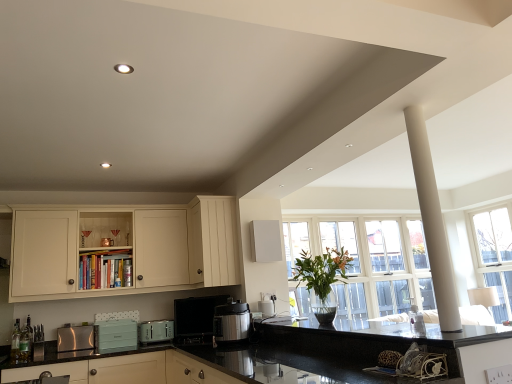
Question: Is black granite countertop at center, acting as the second countertop starting from the right, facing away from white smooth column at upper right?

Choices:
 (A) yes
 (B) no

Answer: (B)

Question: From a real-world perspective, is black granite countertop at center, acting as the second countertop starting from the right, below white smooth column at upper right?

Choices:
 (A) no
 (B) yes

Answer: (B)

Question: Does black granite countertop at center, acting as the second countertop starting from the right, have a smaller size compared to white smooth column at upper right?

Choices:
 (A) yes
 (B) no

Answer: (B)

Question: Considering the relative positions of black granite countertop at center, the 1th countertop when ordered from left to right, and white smooth column at upper right in the image provided, is black granite countertop at center, the 1th countertop when ordered from left to right, to the left of white smooth column at upper right from the viewer's perspective?

Choices:
 (A) no
 (B) yes

Answer: (B)

Question: Is black granite countertop at center, acting as the second countertop starting from the right, with white smooth column at upper right?

Choices:
 (A) no
 (B) yes

Answer: (A)

Question: Is green glass bottle at lower left, positioned as the second bottle in left-to-right order, taller or shorter than translucent glass bottle at lower left, which is the second bottle from top to bottom?

Choices:
 (A) tall
 (B) short

Answer: (A)

Question: Does point (24, 340) appear closer or farther from the camera than point (11, 334)?

Choices:
 (A) closer
 (B) farther

Answer: (B)

Question: Based on their sizes in the image, would you say green glass bottle at lower left, positioned as the second bottle in left-to-right order, is bigger or smaller than translucent glass bottle at lower left, arranged as the third bottle when viewed from the back?

Choices:
 (A) small
 (B) big

Answer: (B)

Question: From a real-world perspective, is green glass bottle at lower left, the second bottle viewed from the front, physically located above or below translucent glass bottle at lower left, which is the second bottle from top to bottom?

Choices:
 (A) below
 (B) above

Answer: (B)

Question: From a real-world perspective, is matte cream cabinets at lower center, the 3th cabinetry when ordered from top to bottom, physically located above or below metallic silver pressure cooker at center?

Choices:
 (A) above
 (B) below

Answer: (B)

Question: Would you say matte cream cabinets at lower center, placed as the 1th cabinetry when sorted from bottom to top, is to the left or to the right of metallic silver pressure cooker at center in the picture?

Choices:
 (A) right
 (B) left

Answer: (B)

Question: Based on their sizes in the image, would you say matte cream cabinets at lower center, the 3th cabinetry when ordered from top to bottom, is bigger or smaller than metallic silver pressure cooker at center?

Choices:
 (A) small
 (B) big

Answer: (B)

Question: From the image's perspective, is matte cream cabinets at lower center, the 3th cabinetry when ordered from top to bottom, above or below metallic silver pressure cooker at center?

Choices:
 (A) above
 (B) below

Answer: (B)

Question: Is metallic silver coffee maker at center, which is counted as the 1th appliance, starting from the right, wider or thinner than matte cream cabinets at lower center, placed as the 1th cabinetry when sorted from bottom to top?

Choices:
 (A) thin
 (B) wide

Answer: (A)

Question: Does point (174, 301) appear closer or farther from the camera than point (138, 372)?

Choices:
 (A) closer
 (B) farther

Answer: (B)